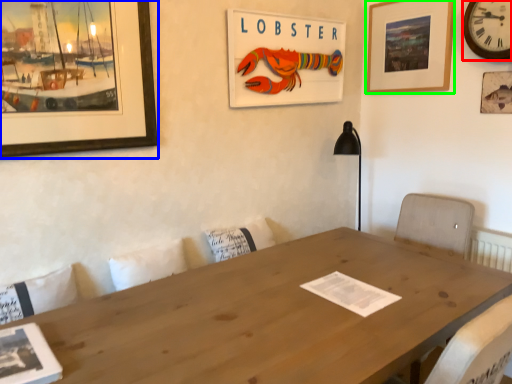
Question: Which object is positioned closest to clock (highlighted by a red box)? Select from picture frame (highlighted by a blue box) and picture frame (highlighted by a green box).

Choices:
 (A) picture frame
 (B) picture frame

Answer: (B)